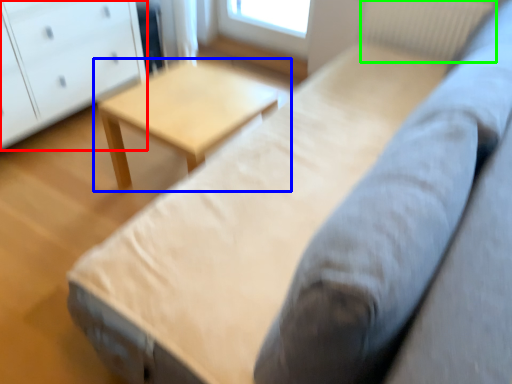
Question: Which object is the farthest from chest of drawers (highlighted by a red box)? Choose among these: table (highlighted by a blue box) or radiator (highlighted by a green box).

Choices:
 (A) table
 (B) radiator

Answer: (B)